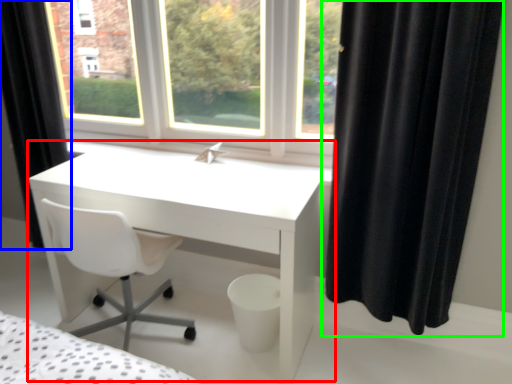
Question: Estimate the real-world distances between objects in this image. Which object is closer to table (highlighted by a red box), curtain (highlighted by a blue box) or curtain (highlighted by a green box)?

Choices:
 (A) curtain
 (B) curtain

Answer: (B)